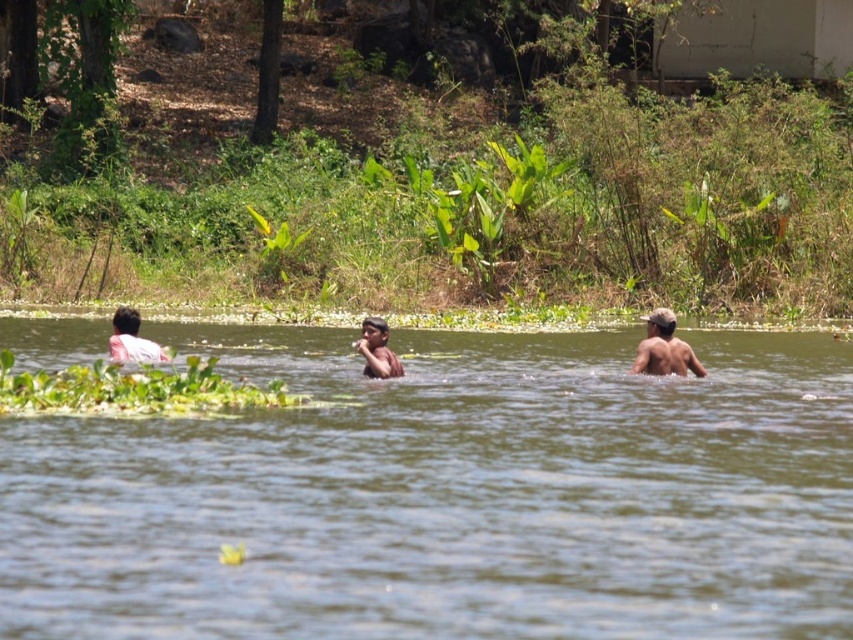
Question: Which of the following is the closest to the observer?

Choices:
 (A) (393, 360)
 (B) (685, 552)
 (C) (637, 364)

Answer: (B)

Question: Can you confirm if white cloth at left is thinner than smooth skin person at center?

Choices:
 (A) yes
 (B) no

Answer: (B)

Question: Which point is closer to the camera?

Choices:
 (A) (131, 337)
 (B) (97, 534)
 (C) (647, 349)

Answer: (B)

Question: Where is brown skin at right located in relation to smooth skin person at center in the image?

Choices:
 (A) above
 (B) below

Answer: (A)

Question: Is brown skin at right smaller than white cloth at left?

Choices:
 (A) no
 (B) yes

Answer: (B)

Question: Estimate the real-world distances between objects in this image. Which object is farther from the white cloth at left?

Choices:
 (A) brown skin at right
 (B) smooth skin person at center
 (C) brown murky water at center

Answer: (A)